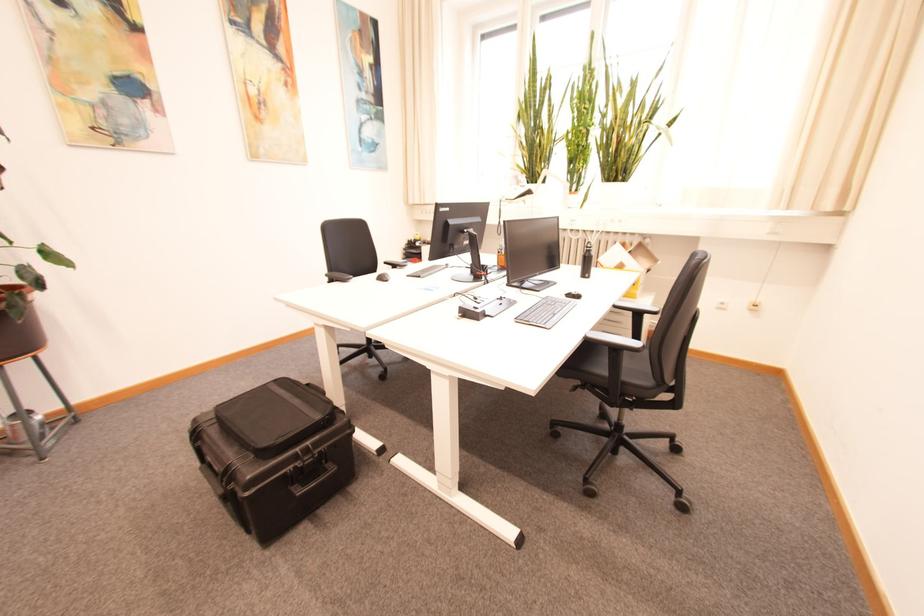
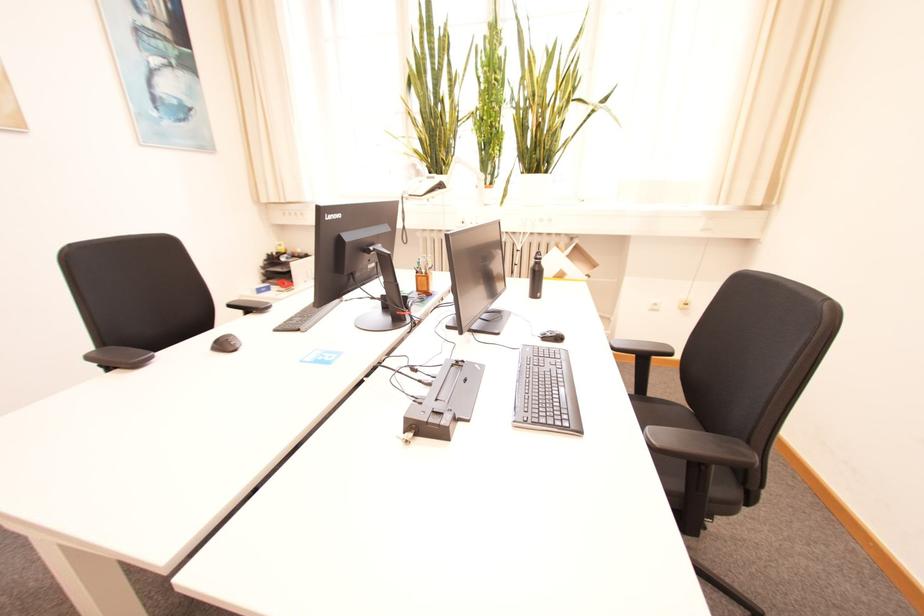
Find the pixel in the second image that matches point 388,280 in the first image.

(229, 346)